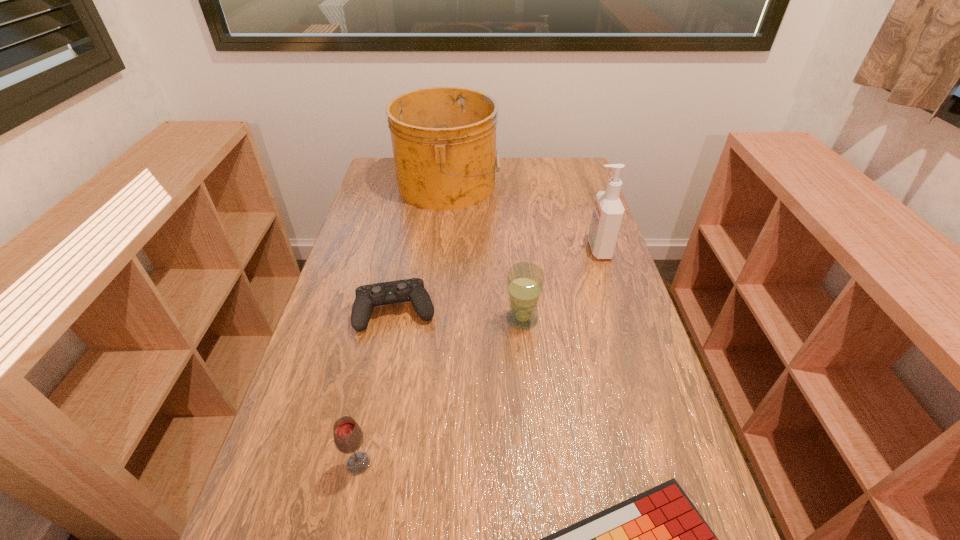
In the image, there is a desktop. Identify the location of vacant space at the left edge. click(303, 478).

Find the location of a particular element. vacant area at the right edge of the desktop is located at coordinates (571, 281).

Identify the location of unoccupied position between the farther glass drink container and the fifth tallest object. The image size is (960, 540). (459, 315).

At what (x,y) coordinates should I click in order to perform the action: click on empty location between the cleansing agent and the control. Please return your answer as a coordinate pair (x, y). Looking at the image, I should click on (497, 280).

The image size is (960, 540). I want to click on vacant area that lies between the farthest object and the cleansing agent, so click(523, 217).

Find the location of `free space between the control and the fifth farthest object`. free space between the control and the fifth farthest object is located at coordinates (377, 387).

The height and width of the screenshot is (540, 960). Identify the location of empty space between the second farthest object and the fifth tallest object. (497, 280).

Find the location of a particular element. The image size is (960, 540). vacant space that is in between the fifth tallest object and the farther glass drink container is located at coordinates click(459, 315).

Locate an element on the screen. This screenshot has width=960, height=540. vacant area between the cleansing agent and the control is located at coordinates (497, 280).

Where is `vacant space that is in between the farthest object and the right glass drink container`? The width and height of the screenshot is (960, 540). vacant space that is in between the farthest object and the right glass drink container is located at coordinates (485, 252).